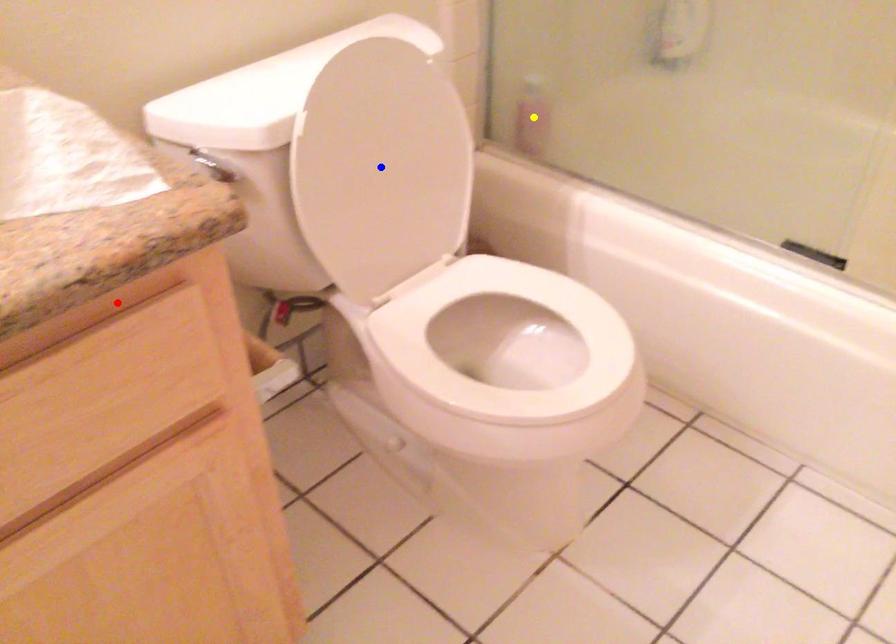
Order these from nearest to farthest:
yellow point
red point
blue point

red point
blue point
yellow point